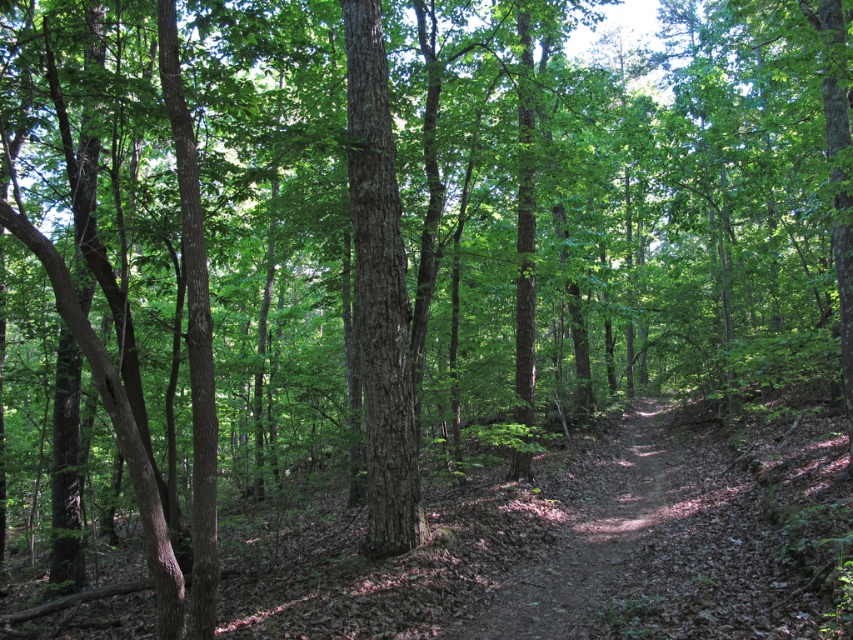
Is point (508, 602) in front of point (405, 432)?

Yes.

Who is shorter, brown dirt trail at center or smooth brown tree trunk at center?

brown dirt trail at center

Describe the element at coordinates (592, 541) in the screenshot. The width and height of the screenshot is (853, 640). I see `brown dirt trail at center` at that location.

This screenshot has height=640, width=853. Identify the location of brown dirt trail at center. (592, 541).